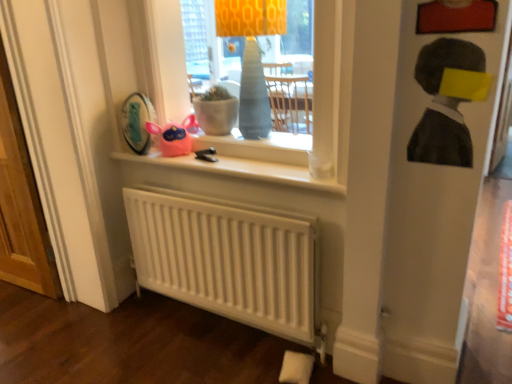
You are a GUI agent. You are given a task and a screenshot of the screen. Output one action in this format:
    pyautogui.click(x=<x>, y=<y>)
    Task: Click on the vacant area that is in front of white matte radiator at lower center
    The width and height of the screenshot is (512, 384).
    Given the screenshot: What is the action you would take?
    pyautogui.click(x=221, y=356)